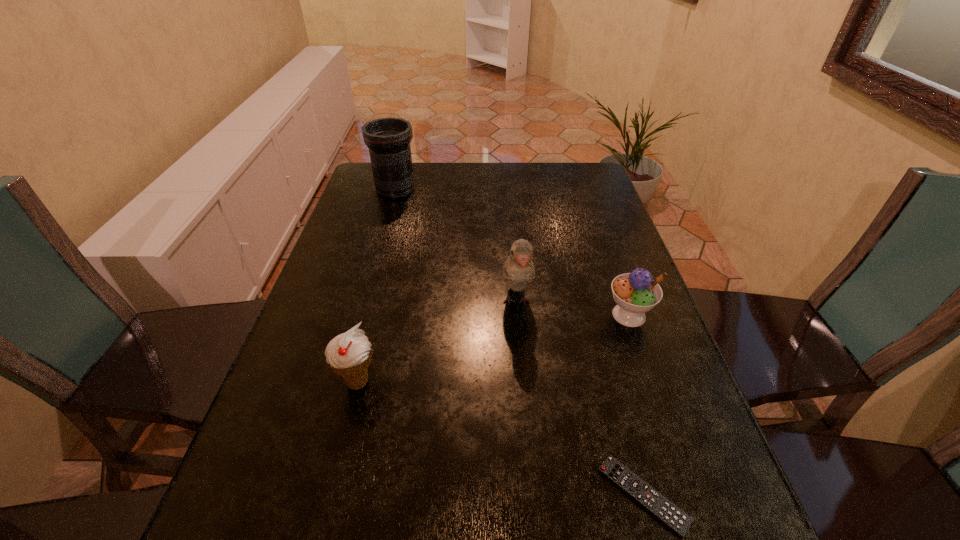
Find the location of a particular element. vacant space located on the back of the left icecream is located at coordinates (391, 249).

Locate an element on the screen. free spot located 0.320m on the front of the farther icecream is located at coordinates (684, 473).

The width and height of the screenshot is (960, 540). Identify the location of free location located on the left of the shortest object. (548, 495).

The image size is (960, 540). I want to click on object present at the far edge, so click(388, 139).

Locate an element on the screen. telephoto lens at the left edge is located at coordinates (388, 139).

This screenshot has width=960, height=540. In order to click on icecream that is at the left edge in this screenshot , I will do `click(349, 354)`.

Identify the location of icecream that is at the right edge. (635, 293).

Where is `remote control that is at the right edge`? The image size is (960, 540). remote control that is at the right edge is located at coordinates (669, 514).

The image size is (960, 540). I want to click on object that is at the far left corner, so click(388, 139).

In the image, there is a desktop. Identify the location of vacant space at the far edge. (449, 194).